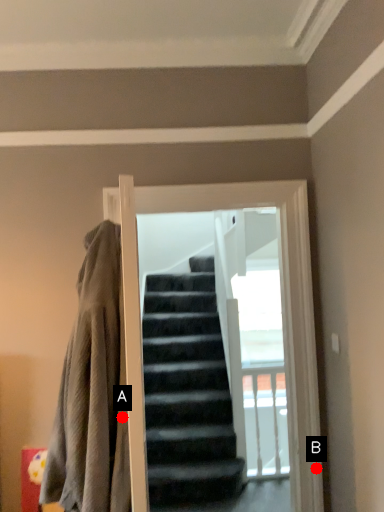
Question: Two points are circled on the image, labeled by A and B beside each circle. Which point is closer to the camera?

Choices:
 (A) A is closer
 (B) B is closer

Answer: (A)